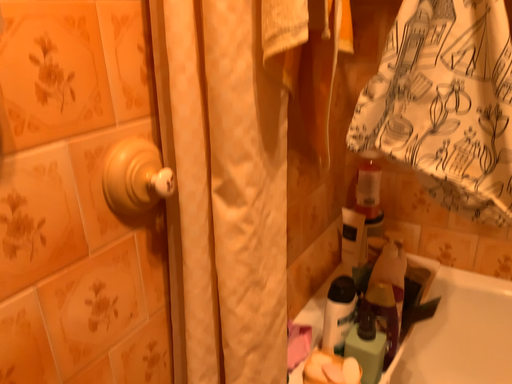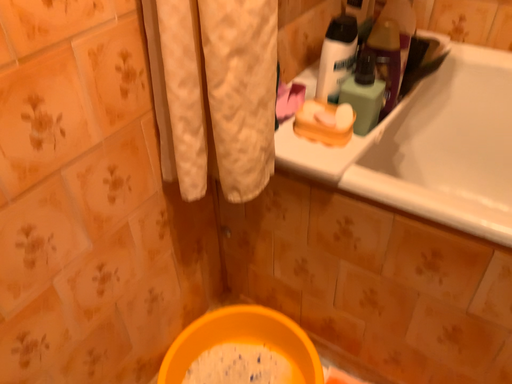
Question: Which way did the camera rotate in the video?

Choices:
 (A) rotated downward
 (B) rotated upward

Answer: (A)